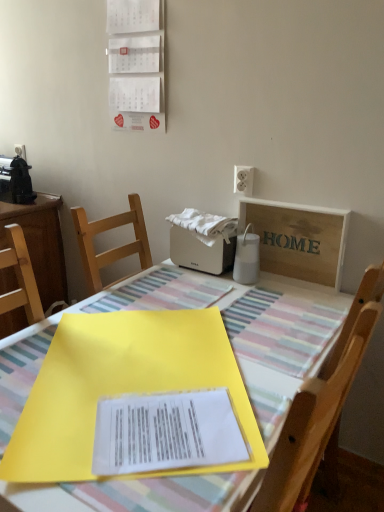
I want to click on free space in front of wooden sign at upper right, so click(291, 303).